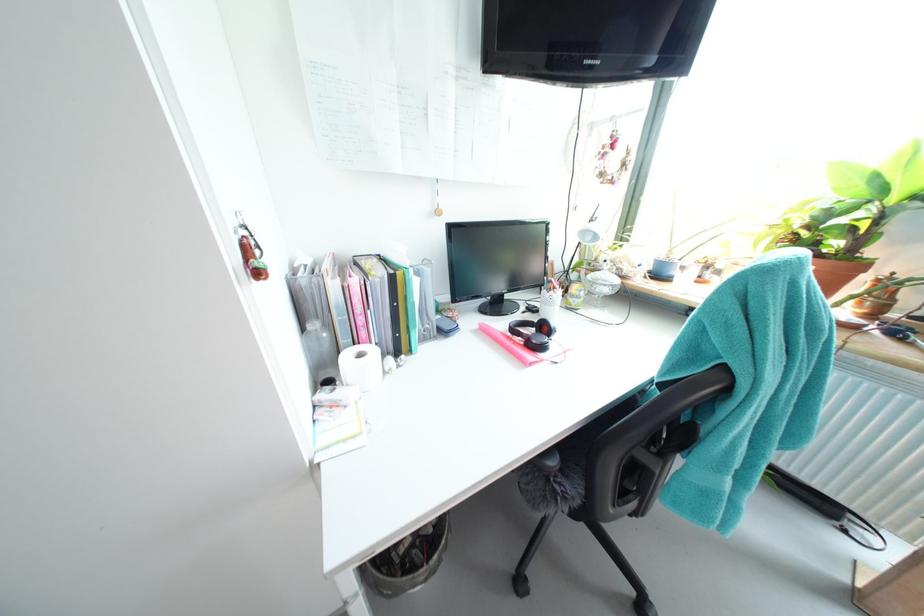
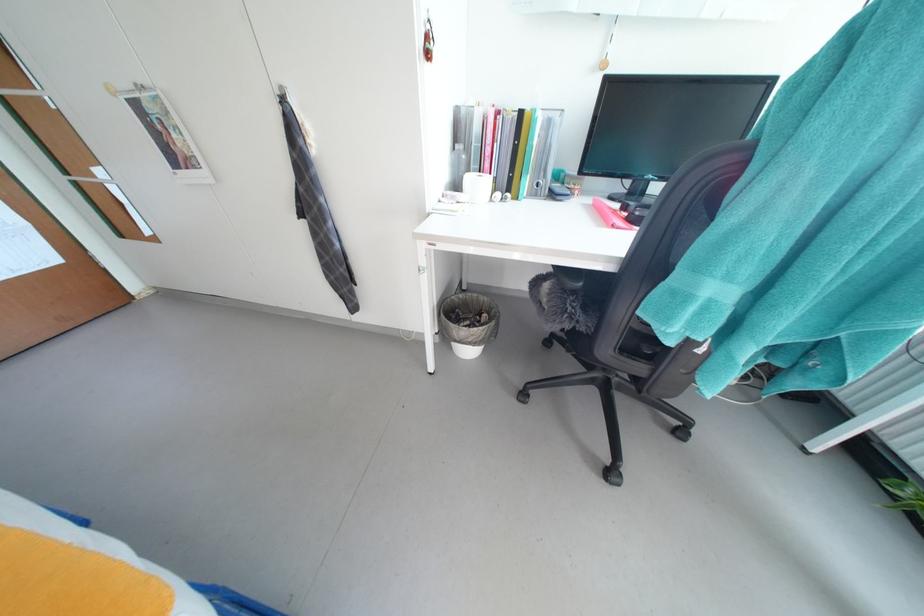
The first image is from the beginning of the video and the second image is from the end. How did the camera likely rotate when shooting the video?

The rotation direction of the camera is left-down.